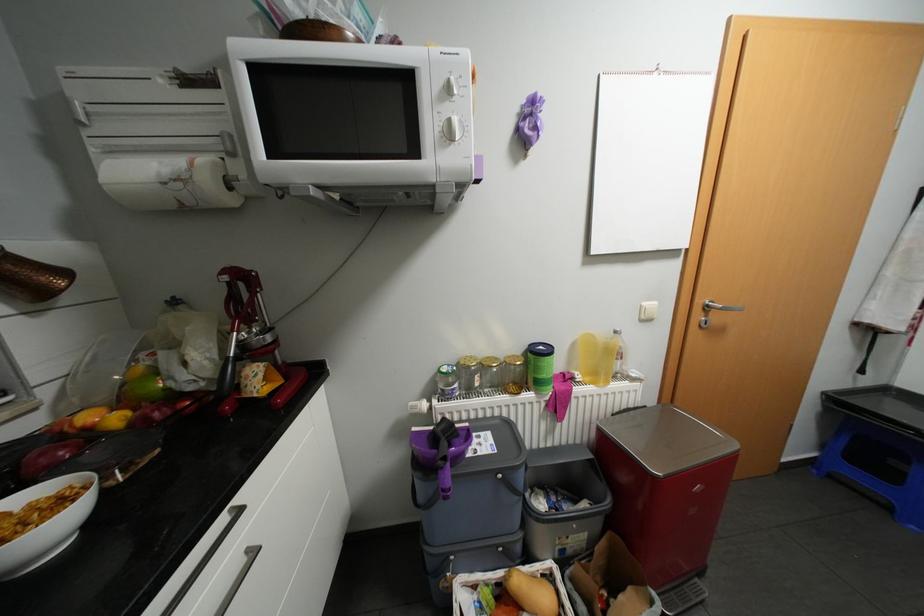
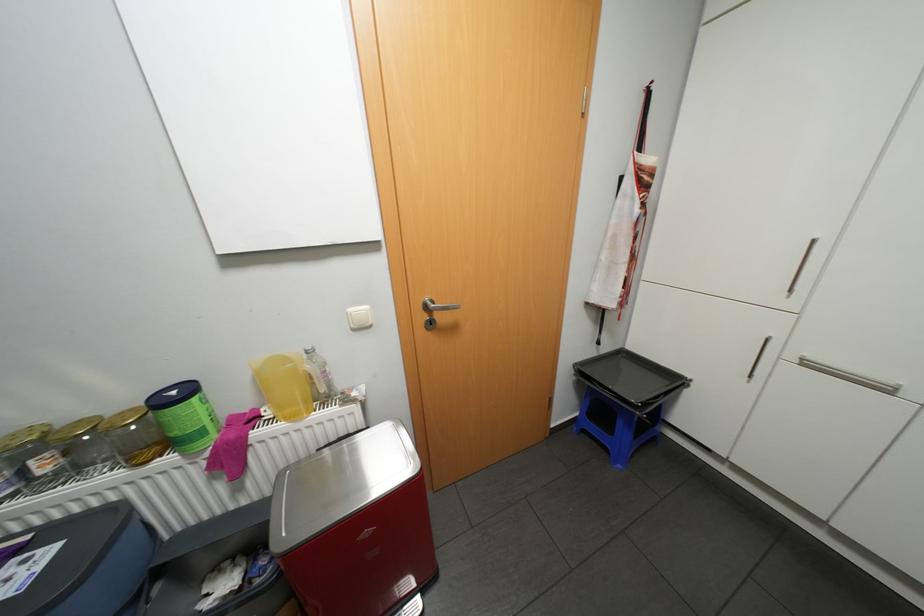
Question: How did the camera likely rotate?

Choices:
 (A) Left
 (B) Right
 (C) Up
 (D) Down

Answer: (B)